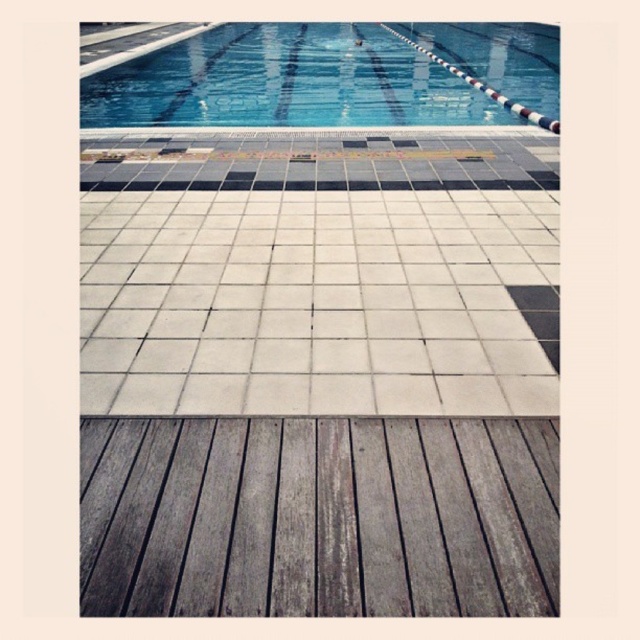
Question: Is gray weathered wood plank at center in front of blue glossy water at upper center?

Choices:
 (A) yes
 (B) no

Answer: (A)

Question: Which object appears closest to the camera in this image?

Choices:
 (A) gray weathered wood plank at center
 (B) blue glossy water at upper center

Answer: (A)

Question: In this image, where is gray weathered wood plank at center located relative to blue glossy water at upper center?

Choices:
 (A) left
 (B) right

Answer: (A)

Question: Which object appears closest to the camera in this image?

Choices:
 (A) gray weathered wood plank at center
 (B) blue glossy water at upper center

Answer: (A)

Question: Can you confirm if gray weathered wood plank at center is positioned to the right of blue glossy water at upper center?

Choices:
 (A) no
 (B) yes

Answer: (A)